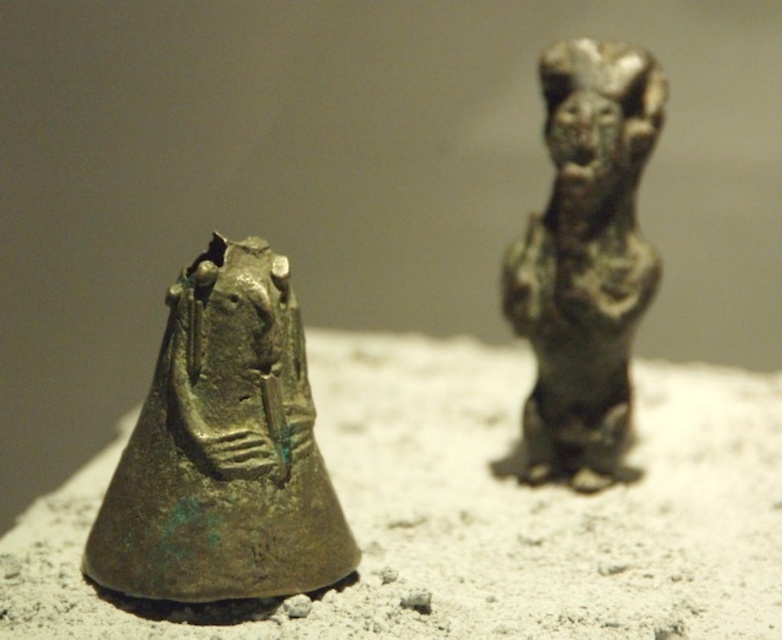
You are an archaeologist examining the image of two ancient bronze artifacts on a light surface. You need to locate the green patina bronze statue at left. Where exactly is it positioned in the image?

The green patina bronze statue at left is positioned at point 0.703 on the horizontal axis and 0.286 on the vertical axis.

You are an archaeologist examining the two artifacts. You need to measure the distance between the green patina bronze statue at left and the bronze figurine at right. Which one should you start measuring from first?

You should start measuring from the green patina bronze statue at left because it is closer to you than the bronze figurine at right.

You are an archaeologist examining the two artifacts. Which of the two, the green patina bronze statue at left or the bronze figurine at right, is taller?

The bronze figurine at right is taller than the green patina bronze statue at left.